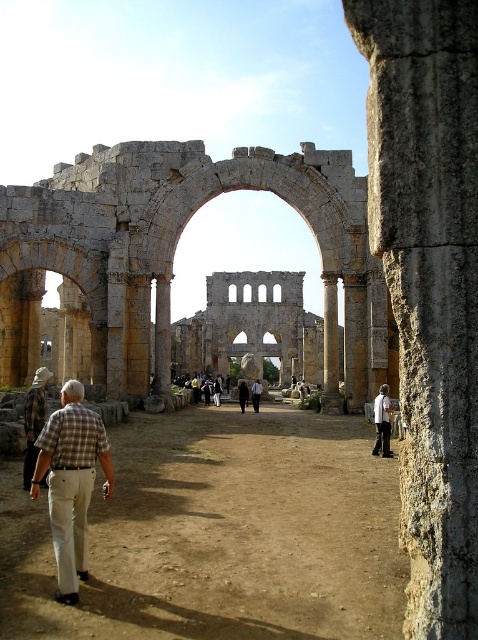
Is gray stone column at center further to camera compared to plaid shirt at lower left?

No, gray stone column at center is in front of plaid shirt at lower left.

Who is positioned more to the left, gray stone column at center or plaid shirt at lower left?

plaid shirt at lower left is more to the left.

Image resolution: width=478 pixels, height=640 pixels. What do you see at coordinates (428, 284) in the screenshot?
I see `gray stone column at center` at bounding box center [428, 284].

Locate an element on the screen. The image size is (478, 640). gray stone column at center is located at coordinates (428, 284).

Does stone archway at center appear over dark brown leather jacket at center?

Yes.

Is point (123, 352) farther from camera compared to point (256, 385)?

That is False.

Is point (134, 396) farther from camera compared to point (254, 388)?

No, (134, 396) is closer to viewer.

This screenshot has height=640, width=478. I want to click on stone archway at center, so click(173, 253).

Between plaid shirt at lower left and dark brown leather jacket at center, which one appears on the right side from the viewer's perspective?

From the viewer's perspective, dark brown leather jacket at center appears more on the right side.

Can you confirm if plaid shirt at lower left is positioned above dark brown leather jacket at center?

Incorrect, plaid shirt at lower left is not positioned above dark brown leather jacket at center.

This screenshot has height=640, width=478. Identify the location of plaid shirt at lower left. (71, 483).

This screenshot has width=478, height=640. I want to click on plaid shirt at lower left, so click(71, 483).